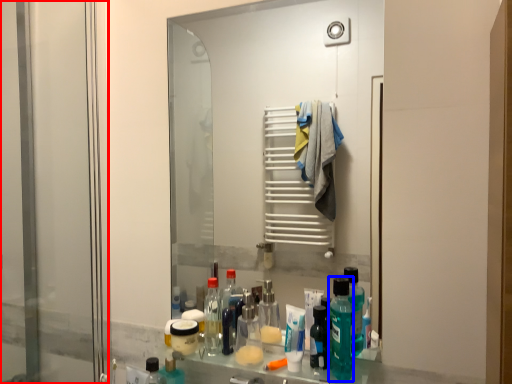
Question: Among these objects, which one is farthest to the camera, screen door (highlighted by a red box) or cleaning product (highlighted by a blue box)?

Choices:
 (A) screen door
 (B) cleaning product

Answer: (A)